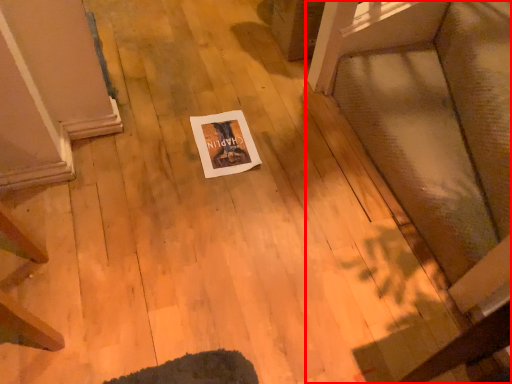
Question: From the image, what is the correct spatial relationship of furniture (annotated by the red box) in relation to postcard?

Choices:
 (A) right
 (B) left

Answer: (A)